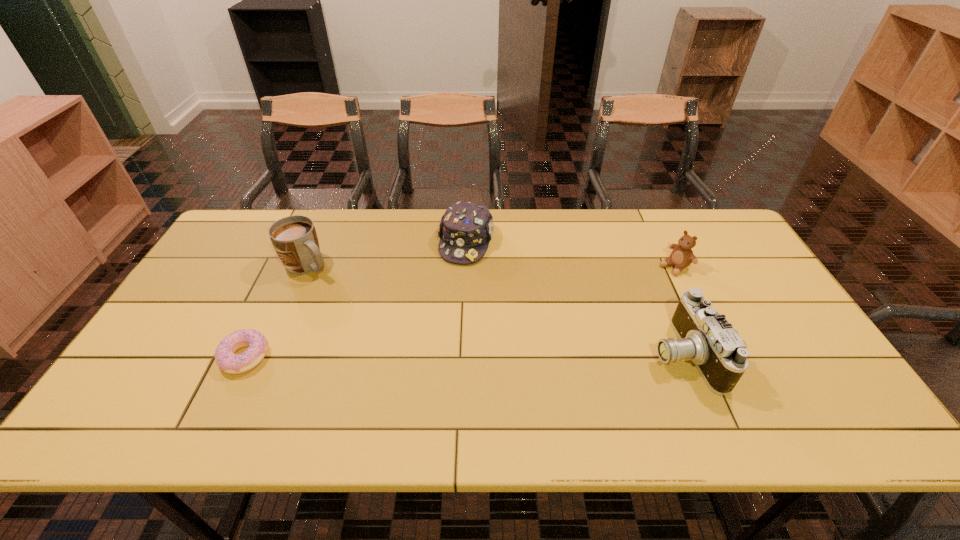
Image resolution: width=960 pixels, height=540 pixels. Find the location of `vacant region located 0.400m on the front-facing side of the teddy bear`. vacant region located 0.400m on the front-facing side of the teddy bear is located at coordinates (565, 330).

You are a GUI agent. You are given a task and a screenshot of the screen. Output one action in this format:
    pyautogui.click(x=<x>, y=<y>)
    Task: Click on the free region located 0.070m on the front-facing side of the teddy bear
    The image size is (960, 540).
    Given the screenshot: What is the action you would take?
    pyautogui.click(x=649, y=281)

Image resolution: width=960 pixels, height=540 pixels. In order to click on vacant area situated 0.140m on the side of the mug with the handle in this screenshot , I will do `click(354, 297)`.

What are the coordinates of `free space located on the side of the mug with the handle` in the screenshot? It's located at (369, 307).

The height and width of the screenshot is (540, 960). I want to click on vacant space located 0.310m on the side of the mug with the handle, so click(x=396, y=326).

In order to click on free space located on the front-facing side of the third object from left to right in this screenshot , I will do `click(456, 279)`.

Where is `free location located on the front-facing side of the third object from left to right`? The height and width of the screenshot is (540, 960). free location located on the front-facing side of the third object from left to right is located at coordinates (429, 364).

Identify the location of blank space located on the front-facing side of the third object from left to right. (429, 364).

The height and width of the screenshot is (540, 960). What are the coordinates of `mug at the far edge` in the screenshot? It's located at (294, 238).

This screenshot has height=540, width=960. What are the coordinates of `headwear present at the far edge` in the screenshot? It's located at (466, 228).